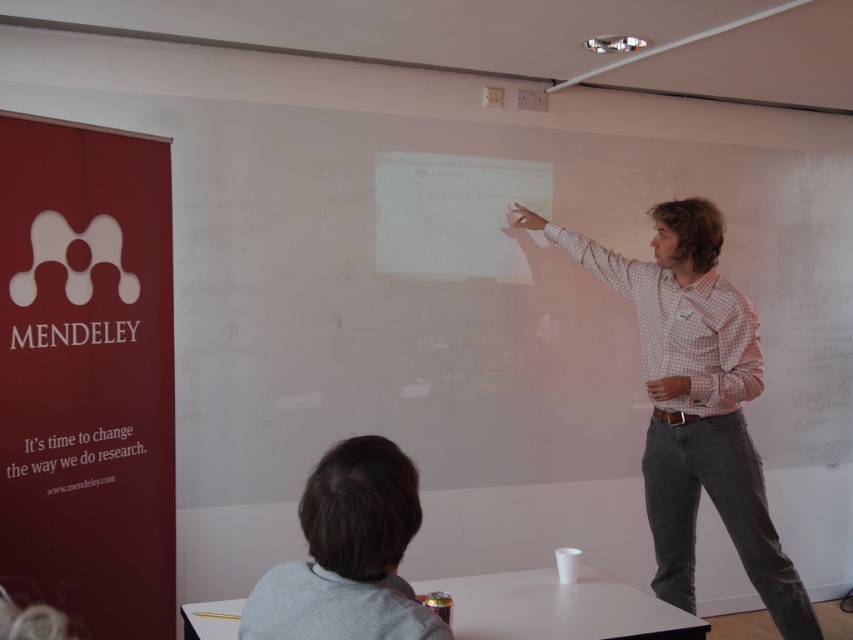
Does gray cotton shirt at lower left come in front of white paper at lower left?

Yes, gray cotton shirt at lower left is in front of white paper at lower left.

Who is positioned more to the right, gray cotton shirt at lower left or white paper at lower left?

From the viewer's perspective, gray cotton shirt at lower left appears more on the right side.

Image resolution: width=853 pixels, height=640 pixels. Find the location of `gray cotton shirt at lower left`. gray cotton shirt at lower left is located at coordinates (347, 554).

Where is `gray cotton shirt at lower left`? gray cotton shirt at lower left is located at coordinates (347, 554).

Which is in front, point (669, 314) or point (393, 486)?

Point (393, 486)

Who is more distant from viewer, (651, 488) or (335, 598)?

The point (651, 488) is behind.

I want to click on white checkered shirt at upper right, so click(x=695, y=403).

Is white checkered shirt at upper right bigger than white paper at lower left?

Yes.

Is point (662, 275) in front of point (135, 452)?

No, it is not.

Is point (798, 592) positioned after point (96, 474)?

Yes, it is behind point (96, 474).

Where is `white checkered shirt at upper right`? white checkered shirt at upper right is located at coordinates (695, 403).